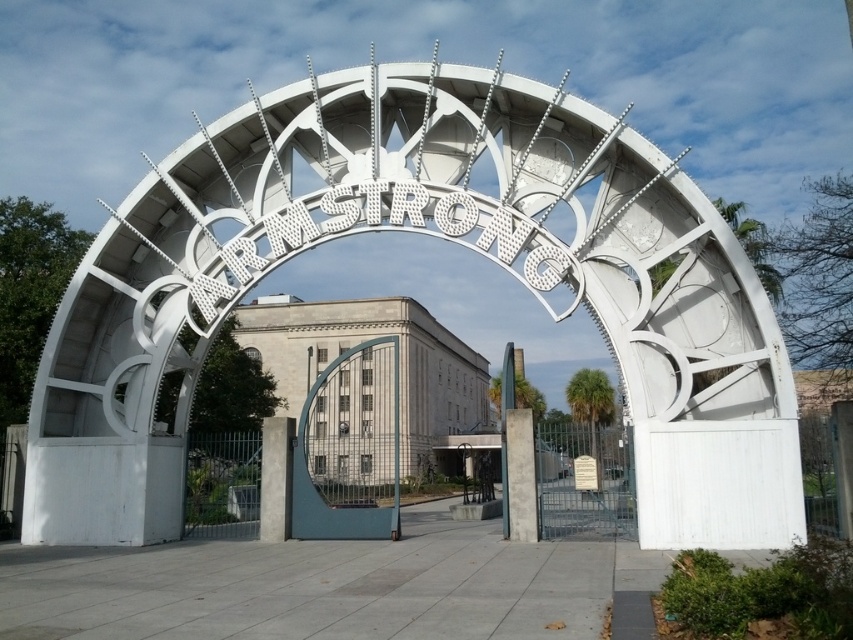
Question: Does white metallic gate at center appear on the right side of blue metallic gate at center?

Choices:
 (A) no
 (B) yes

Answer: (B)

Question: Which point is closer to the camera taking this photo?

Choices:
 (A) (328, 515)
 (B) (579, 196)

Answer: (B)

Question: Does white metallic gate at center appear under blue metallic gate at center?

Choices:
 (A) yes
 (B) no

Answer: (B)

Question: Does white metallic gate at center appear over blue metallic gate at center?

Choices:
 (A) no
 (B) yes

Answer: (B)